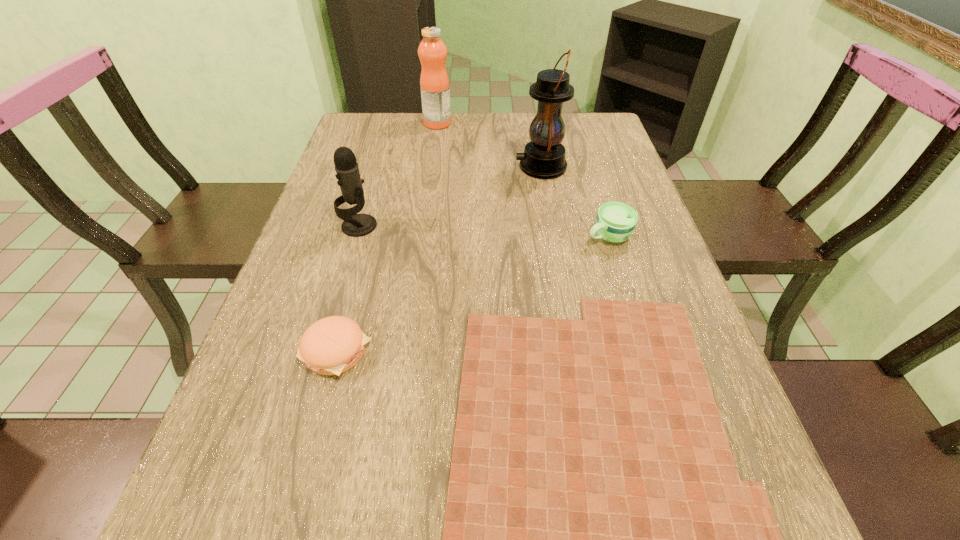
Image resolution: width=960 pixels, height=540 pixels. Find the location of `vacant area that lies between the patty and the third shortest object`. vacant area that lies between the patty and the third shortest object is located at coordinates (472, 294).

Locate an element on the screen. free area in between the microphone and the patty is located at coordinates (348, 288).

Identify which object is located as the fifth nearest to the second shortest object. Please provide its 2D coordinates. Your answer should be formatted as a tuple, i.e. [(x, y)], where the tuple contains the x and y coordinates of a point satisfying the conditions above.

[(434, 83)]

Choose which object is the third nearest neighbor to the patty. Please provide its 2D coordinates. Your answer should be formatted as a tuple, i.e. [(x, y)], where the tuple contains the x and y coordinates of a point satisfying the conditions above.

[(615, 222)]

Locate an element on the screen. This screenshot has width=960, height=540. vacant space that satisfies the following two spatial constraints: 1. above the lantern, indicating its light source; 2. on the back side of the cup is located at coordinates (553, 236).

I want to click on blank area in the image that satisfies the following two spatial constraints: 1. on the front side of the microphone; 2. on the left side of the patty, so click(322, 352).

At what (x,y) coordinates should I click in order to perform the action: click on vacant area that satisfies the following two spatial constraints: 1. above the fifth nearest object, indicating its light source; 2. on the right side of the cup. Please return your answer as a coordinate pair (x, y). The height and width of the screenshot is (540, 960). Looking at the image, I should click on (553, 236).

You are a GUI agent. You are given a task and a screenshot of the screen. Output one action in this format:
    pyautogui.click(x=<x>, y=<y>)
    Task: Click on the vacant space that satisfies the following two spatial constraints: 1. on the back side of the third shortest object; 2. above the fifth nearest object, indicating its light source
    The width and height of the screenshot is (960, 540).
    Given the screenshot: What is the action you would take?
    pyautogui.click(x=587, y=167)

The width and height of the screenshot is (960, 540). In order to click on free spot that satisfies the following two spatial constraints: 1. above the lantern, indicating its light source; 2. on the front side of the microphone in this screenshot , I will do `click(551, 226)`.

Locate an element on the screen. free space in the image that satisfies the following two spatial constraints: 1. on the front side of the cup; 2. on the right side of the fourth object from right to left is located at coordinates click(421, 236).